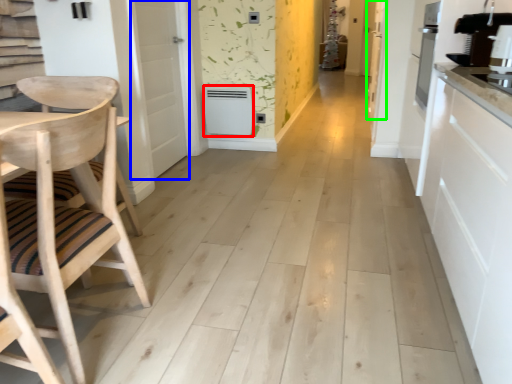
Question: Based on their relative distances, which object is nearer to appliance (highlighted by a red box)? Choose from door (highlighted by a blue box) and door (highlighted by a green box).

Choices:
 (A) door
 (B) door

Answer: (A)